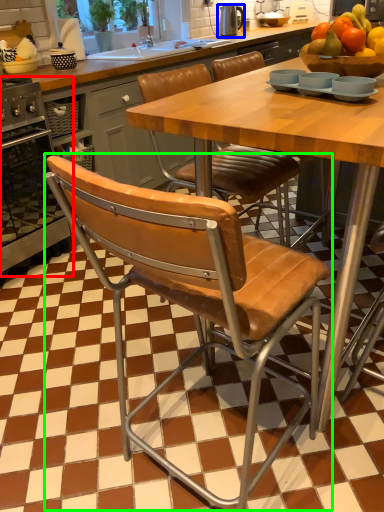
Question: Which is nearer to the oven (highlighted by a red box)? appliance (highlighted by a blue box) or chair (highlighted by a green box).

Choices:
 (A) appliance
 (B) chair

Answer: (B)